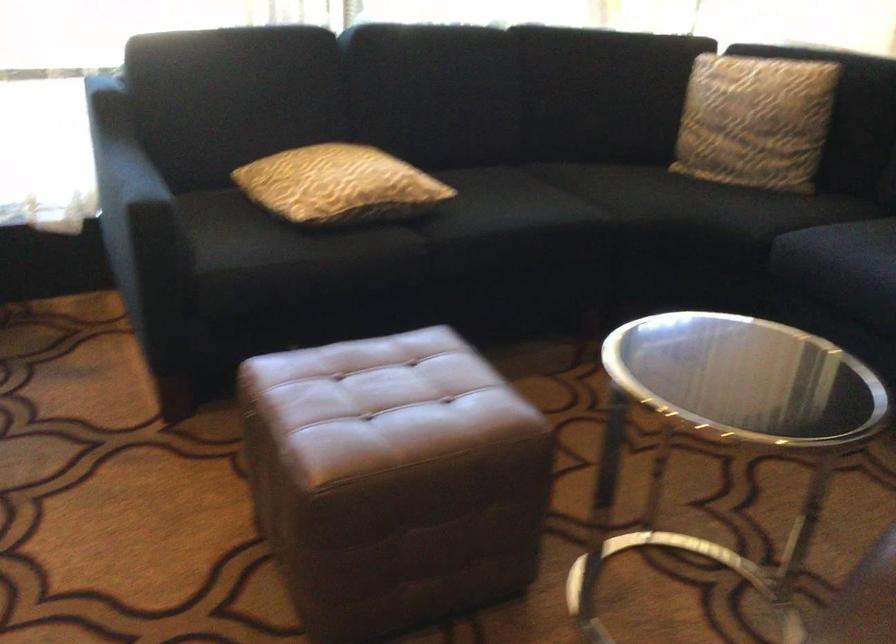
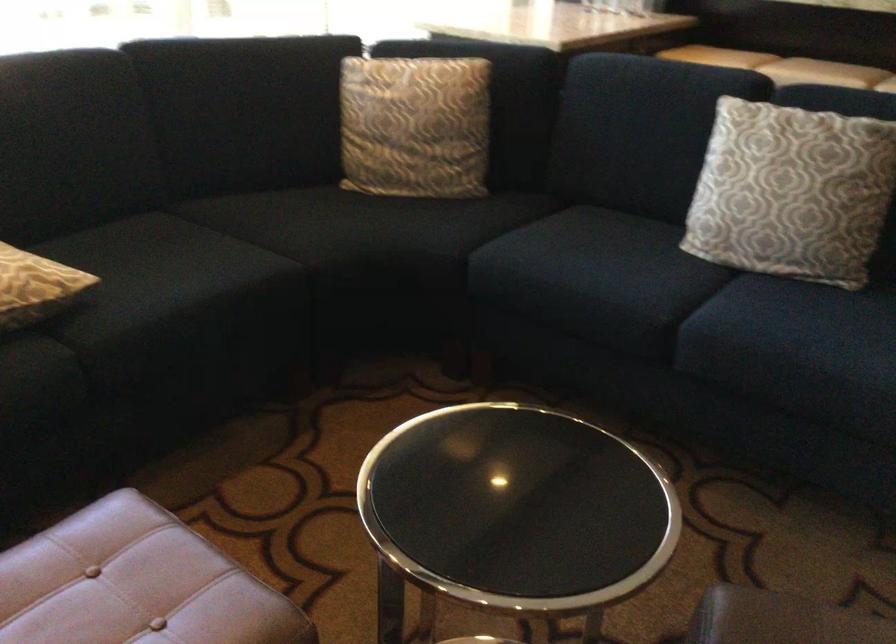
In the second image, find the point that corresponds to (666,194) in the first image.

(348, 227)